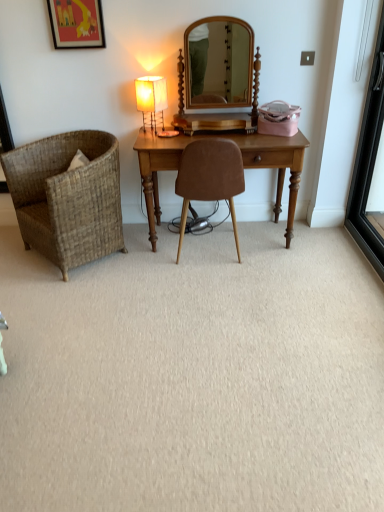
This screenshot has height=512, width=384. I want to click on empty space that is to the right of woven brown chair at left, marked as the 1th chair in a left-to-right arrangement, so click(158, 262).